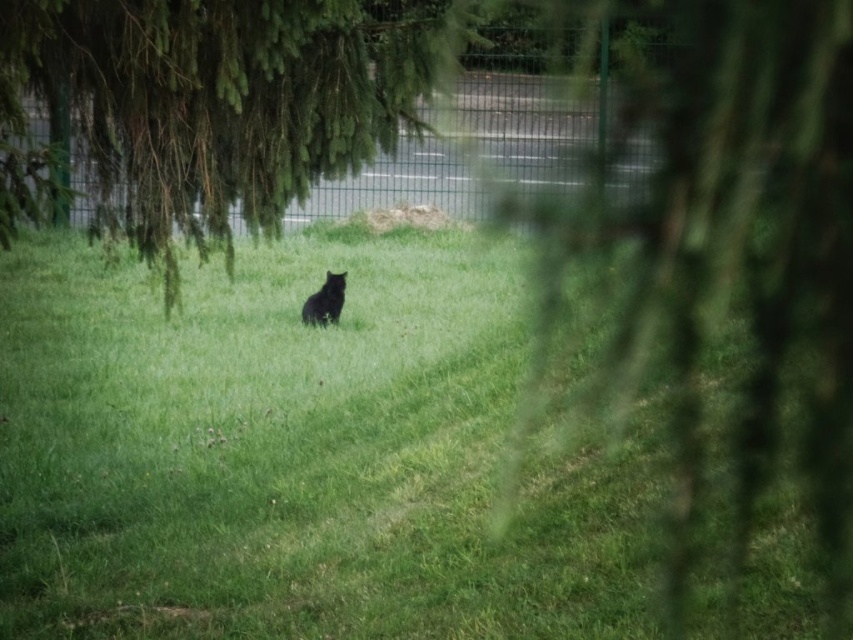
Question: Does green grassy at center appear on the right side of black fur cat at center?

Choices:
 (A) yes
 (B) no

Answer: (A)

Question: Which of the following is the farthest from the observer?

Choices:
 (A) (641, 586)
 (B) (323, 316)
 (C) (6, 93)

Answer: (B)

Question: Is green textured tree at upper left below black fur cat at center?

Choices:
 (A) yes
 (B) no

Answer: (B)

Question: Which of these objects is positioned closest to the black fur cat at center?

Choices:
 (A) green textured tree at upper left
 (B) green grassy at center

Answer: (B)

Question: Which point is farther to the camera?

Choices:
 (A) (318, 308)
 (B) (521, 342)

Answer: (A)

Question: Is green grassy at center to the right of green textured tree at upper left from the viewer's perspective?

Choices:
 (A) no
 (B) yes

Answer: (B)